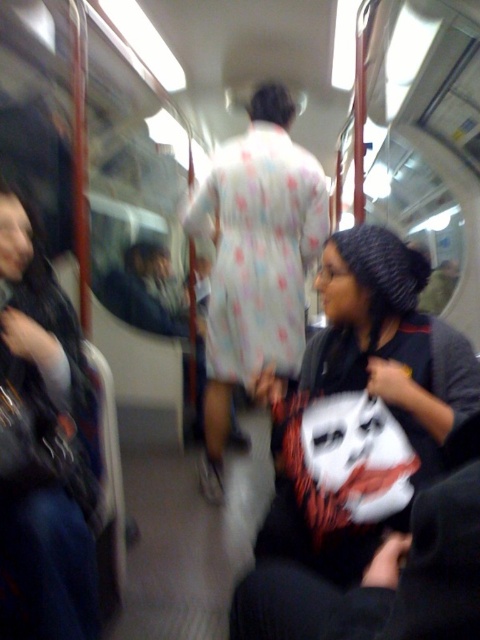
Question: Does white printed shirt at center come behind dark blue jeans at left?

Choices:
 (A) no
 (B) yes

Answer: (A)

Question: Is white printed shirt at center positioned behind dark blue jeans at left?

Choices:
 (A) yes
 (B) no

Answer: (B)

Question: Which point is farther to the camera?

Choices:
 (A) dark blue jeans at left
 (B) white printed shirt at center

Answer: (A)

Question: Can you confirm if white printed shirt at center is thinner than dark blue jeans at left?

Choices:
 (A) no
 (B) yes

Answer: (A)

Question: Which of the following is the closest to the observer?

Choices:
 (A) dark blue jeans at left
 (B) white printed shirt at center

Answer: (B)